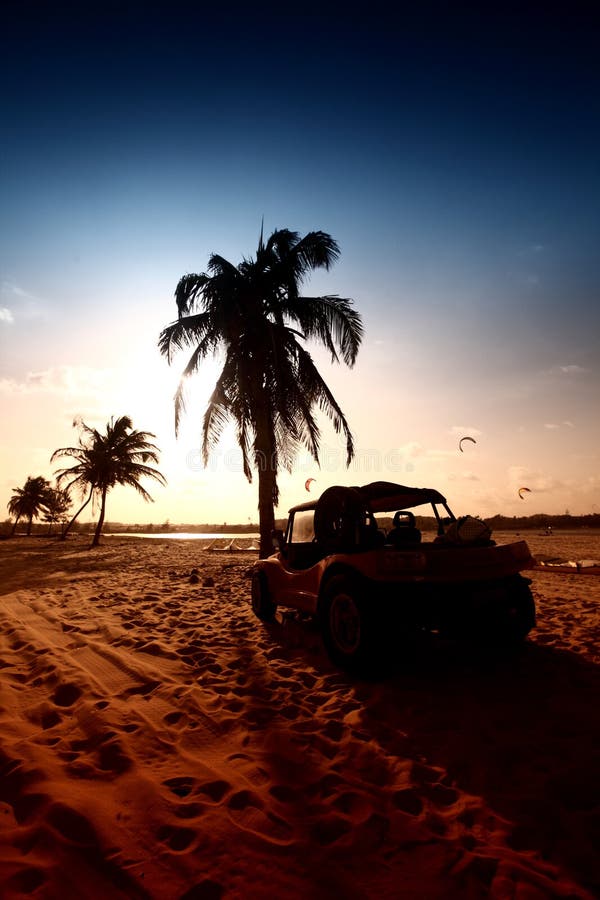
What are the coordinates of `seat` in the screenshot? It's located at (409, 533).